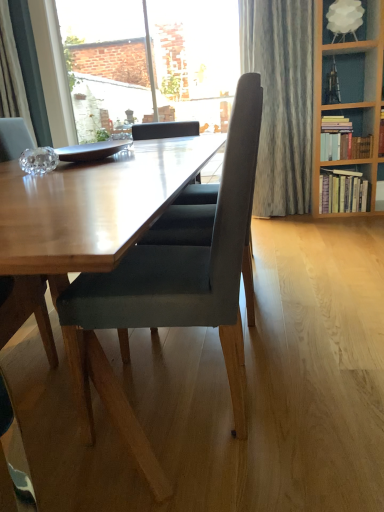
Question: From a real-world perspective, is hardcover books at right, which is counted as the first book, starting from the bottom, below velvet grey chair at center?

Choices:
 (A) yes
 (B) no

Answer: (A)

Question: Is hardcover books at right, which is counted as the first book, starting from the bottom, not within velvet grey chair at center?

Choices:
 (A) no
 (B) yes

Answer: (B)

Question: Can you confirm if hardcover books at right, which appears as the 2th book when viewed from the top, is bigger than velvet grey chair at center?

Choices:
 (A) yes
 (B) no

Answer: (B)

Question: Is hardcover books at right, which is counted as the first book, starting from the bottom, shorter than velvet grey chair at center?

Choices:
 (A) no
 (B) yes

Answer: (B)

Question: Does hardcover books at right, which appears as the 2th book when viewed from the top, appear on the left side of velvet grey chair at center?

Choices:
 (A) yes
 (B) no

Answer: (B)

Question: Does hardcover books at right, which is counted as the first book, starting from the bottom, lie in front of velvet grey chair at center?

Choices:
 (A) no
 (B) yes

Answer: (A)

Question: Can you confirm if transparent glass window at upper center is taller than velvet grey chair at center?

Choices:
 (A) no
 (B) yes

Answer: (B)

Question: Is transparent glass window at upper center further to camera compared to velvet grey chair at center?

Choices:
 (A) yes
 (B) no

Answer: (A)

Question: Would you say transparent glass window at upper center contains velvet grey chair at center?

Choices:
 (A) yes
 (B) no

Answer: (B)

Question: Is transparent glass window at upper center closer to the viewer compared to velvet grey chair at center?

Choices:
 (A) no
 (B) yes

Answer: (A)

Question: From the image's perspective, does transparent glass window at upper center appear lower than velvet grey chair at center?

Choices:
 (A) yes
 (B) no

Answer: (B)

Question: From the image's perspective, is transparent glass window at upper center on top of velvet grey chair at center?

Choices:
 (A) no
 (B) yes

Answer: (B)

Question: Is velvet grey chair at center turned away from transparent glass window at upper center?

Choices:
 (A) yes
 (B) no

Answer: (B)